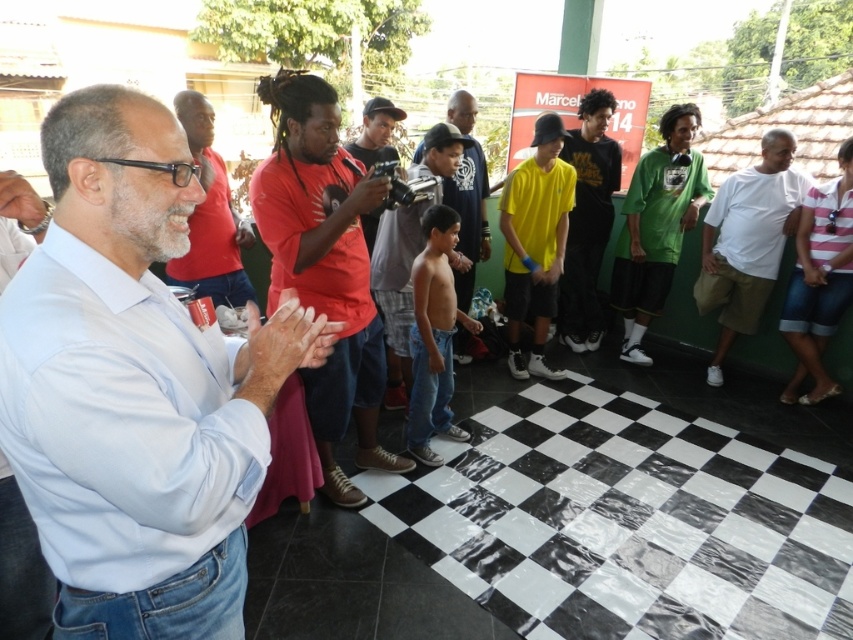
Question: From the image, what is the correct spatial relationship of light blue shirt at center in relation to matte black shirt at center?

Choices:
 (A) above
 (B) below

Answer: (B)

Question: Which point is closer to the camera?

Choices:
 (A) (469, 252)
 (B) (381, 394)
 (C) (225, 208)

Answer: (B)

Question: Estimate the real-world distances between objects in this image. Which object is farther from the matte red shirt at center?

Choices:
 (A) matte black shirt at center
 (B) white cotton shirt at right
 (C) shiny blue shirt at center

Answer: (B)

Question: Based on their relative distances, which object is farther from the matte black shirt at center?

Choices:
 (A) white cotton shirt at right
 (B) matte red shirt at center
 (C) light blue shirt at center
 (D) shiny blue shirt at center

Answer: (A)

Question: Is light blue shirt at center to the right of matte black shirt at center from the viewer's perspective?

Choices:
 (A) yes
 (B) no

Answer: (A)

Question: Can you confirm if light blue shirt at center is positioned below matte black shirt at center?

Choices:
 (A) yes
 (B) no

Answer: (A)